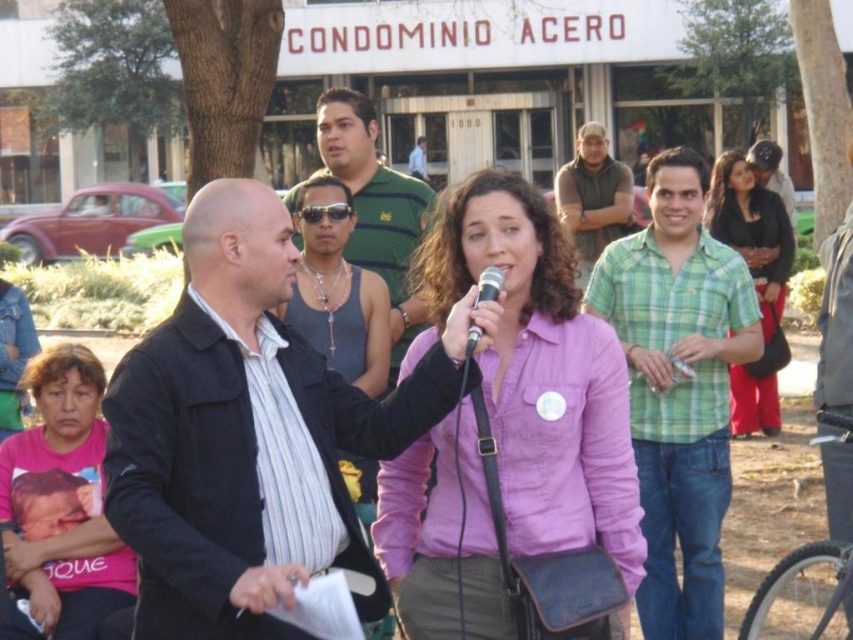
You are standing at the center of the park in front of the CONDOMINIO ACERO building. You see a point marked at coordinates [753,280]. What object is located at that point?

The point at coordinates [753,280] marks the location of the matte green shirt at right.

You are a photographer at the event and need to capture a closeup of the pink cotton shirt at center. The camera can only focus on objects within a 0.1 unit radius of the point at coordinates (538, 371). Will the pink cotton shirt at center be in focus?

The point (538, 371) is on the pink cotton shirt at center, so yes, the pink cotton shirt at center will be in focus since the camera focuses on that exact point.